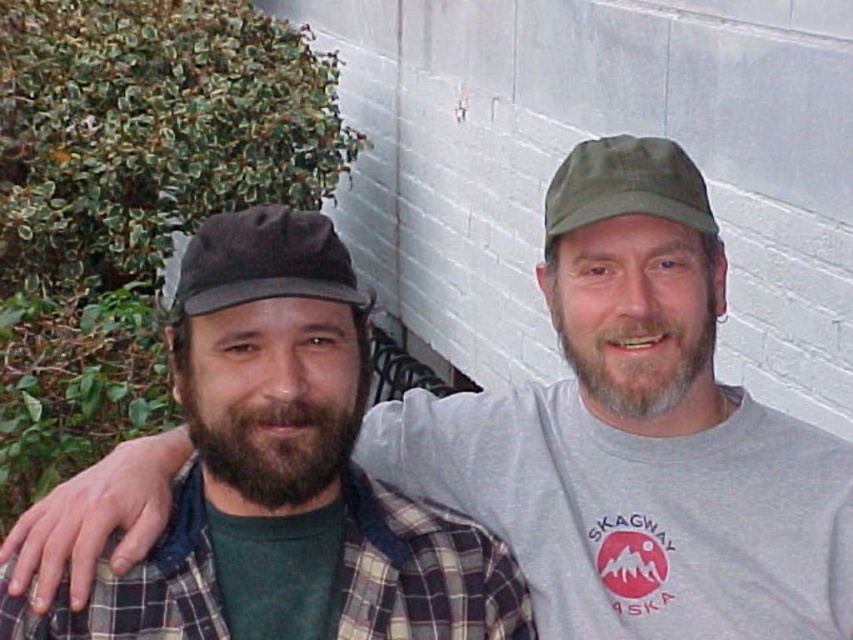
Question: Is dark brown fabric baseball cap at center further to camera compared to green fabric cap at upper center?

Choices:
 (A) no
 (B) yes

Answer: (A)

Question: Is dark brown fabric baseball cap at center closer to the viewer compared to green fabric cap at upper center?

Choices:
 (A) yes
 (B) no

Answer: (A)

Question: Which point appears farthest from the camera in this image?

Choices:
 (A) [x=225, y=292]
 (B) [x=624, y=192]

Answer: (B)

Question: In this image, where is dark brown fabric baseball cap at center located relative to green fabric cap at upper center?

Choices:
 (A) below
 (B) above

Answer: (A)

Question: Among these points, which one is nearest to the camera?

Choices:
 (A) (312, 275)
 (B) (573, 196)

Answer: (A)